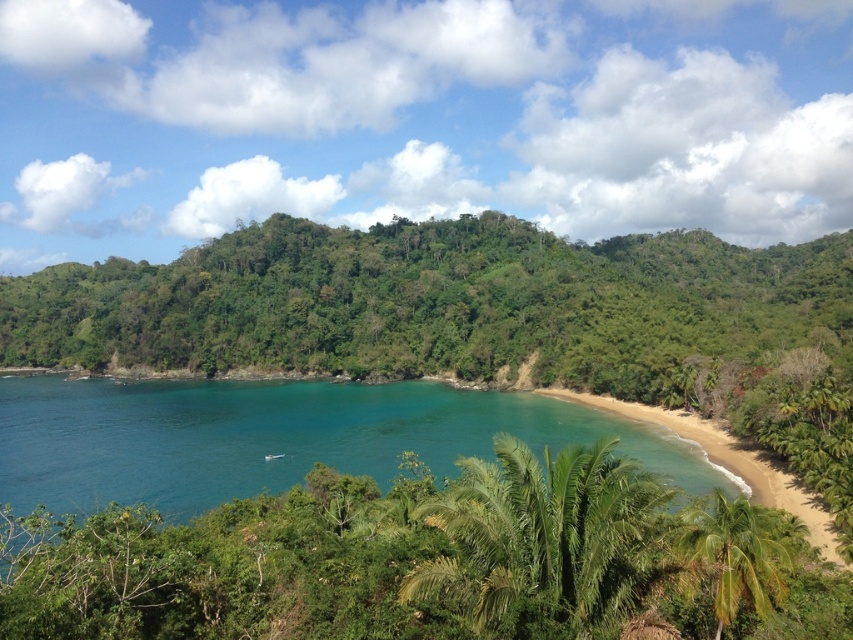
Consider the image. You are standing at the beach looking towards the hill. You see two points marked on the image. The first is at point (570, 618) and the second at point (732, 616). Which point is closer to you?

Point (570, 618) is in front of point (732, 616), so it is closer to you.

You are standing on the beach and see the teal glossy water at center and the green leafy palm tree at lower center. Which object is closer to your right side?

The green leafy palm tree at lower center is to the right of the teal glossy water at center, so it is closer to your right side.

You are standing on the sandy beach and want to take a photo of both the green leafy palm tree at lower center and the green leafy palm tree at lower right. Which palm tree should you position closer to the camera to ensure both fit in the frame?

You should position the green leafy palm tree at lower center closer to the camera because it is wider than the green leafy palm tree at lower right, so it will take up more space in the frame.